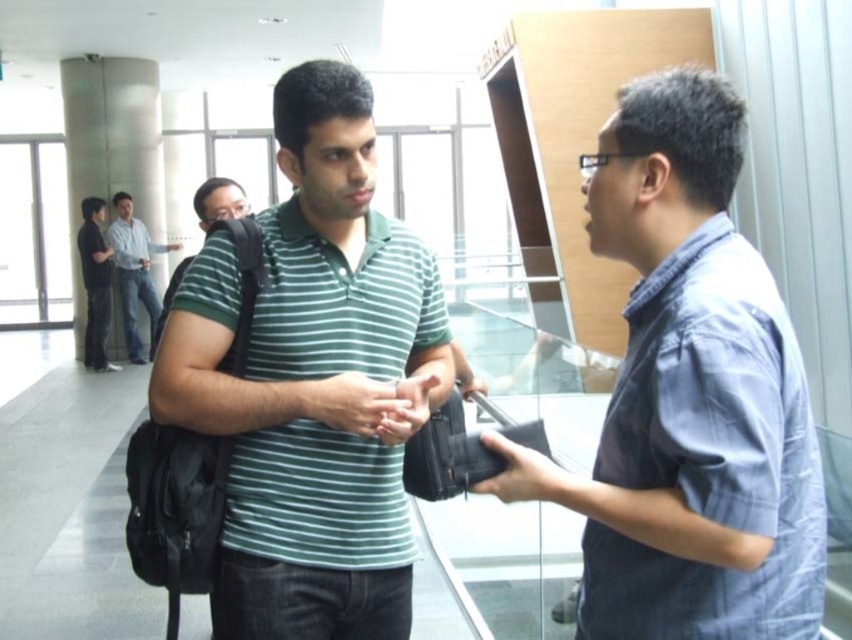
In the image, there is a point located at coordinates (x=366, y=404). Which object from the scene does this point lie on?

The point at coordinates (x=366, y=404) lies on the matte green shirt at center.

You are standing at point (91, 368) and want to walk to the exit located at point (701, 497). Is the exit directly in front of you or behind you?

The exit at point (701, 497) is in front of you because it is located in front of point (91, 368) where you are standing.

You are standing at the entrance of the office and want to greet both people wearing the matte green shirt at center and the light blue shirt at upper left. Which one should you approach first if you want to minimize the total distance walked?

You should approach the matte green shirt at center first because it is closer to the entrance than the light blue shirt at upper left, which is 7.93 meters away from the matte green shirt at center. However, without knowing the exact position of the entrance, it is impossible to determine the closest one definitively.